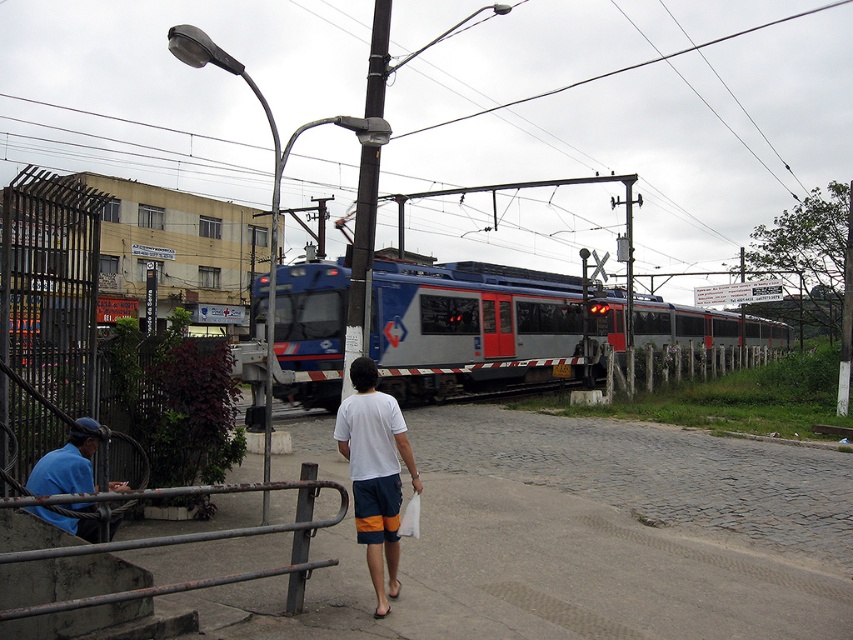
Between point (616, 307) and point (85, 534), which one is positioned in front?

Point (85, 534) is more forward.

Which is behind, point (426, 296) or point (84, 461)?

The point (426, 296) is behind.

Where is `blue metallic train at center`? blue metallic train at center is located at coordinates (468, 323).

Can you confirm if rusty metal rail at lower left is wider than brown wooden pole at center?

No, rusty metal rail at lower left is not wider than brown wooden pole at center.

Does point (180, 588) lie behind point (355, 342)?

No, (180, 588) is closer to viewer.

Is point (94, 596) positioned after point (363, 230)?

No, (94, 596) is in front of (363, 230).

Locate an element on the screen. The height and width of the screenshot is (640, 853). rusty metal rail at lower left is located at coordinates click(x=200, y=531).

Who is shorter, blue metallic train at center or white cotton t-shirt at center?

With less height is white cotton t-shirt at center.

Does blue metallic train at center have a lesser height compared to white cotton t-shirt at center?

No, blue metallic train at center is not shorter than white cotton t-shirt at center.

Which is in front, point (563, 310) or point (373, 426)?

Positioned in front is point (373, 426).

Locate an element on the screen. blue metallic train at center is located at coordinates (468, 323).